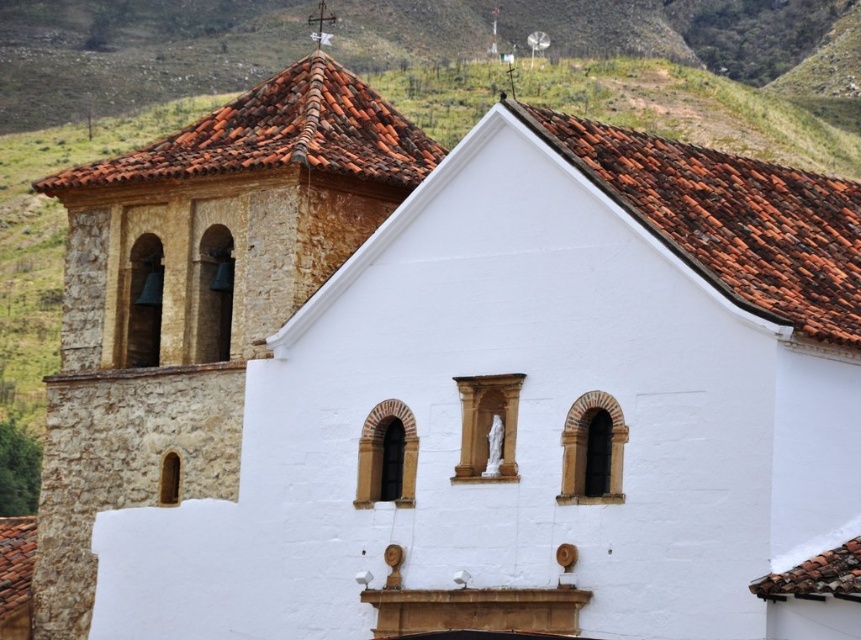
Question: Observing the image, what is the correct spatial positioning of brown clay tiles at upper center in reference to terracotta tiles at upper center?

Choices:
 (A) below
 (B) above

Answer: (B)

Question: Does terracotta tiles at upper center appear under terracotta tiles at upper left?

Choices:
 (A) no
 (B) yes

Answer: (B)

Question: Among these points, which one is farthest from the camera?

Choices:
 (A) [713, 177]
 (B) [812, 253]
 (C) [414, 131]

Answer: (C)

Question: Which point is closer to the camera taking this photo?

Choices:
 (A) (595, 122)
 (B) (302, 124)
 (C) (691, 166)

Answer: (C)

Question: Can you confirm if brown clay tiles at upper center is positioned above terracotta tiles at upper center?

Choices:
 (A) no
 (B) yes

Answer: (B)

Question: Among these points, which one is farthest from the camera?

Choices:
 (A) (533, 125)
 (B) (676, 177)

Answer: (B)